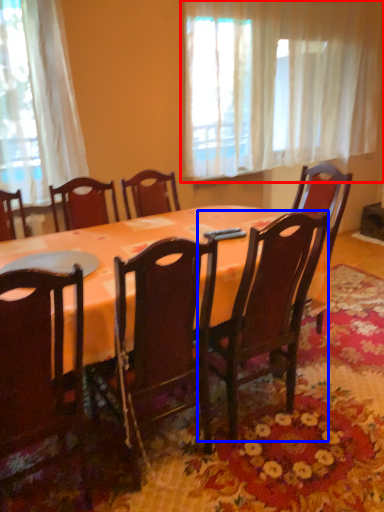
Question: Which point is closer to the camera, curtain (highlighted by a red box) or chair (highlighted by a blue box)?

Choices:
 (A) curtain
 (B) chair

Answer: (B)